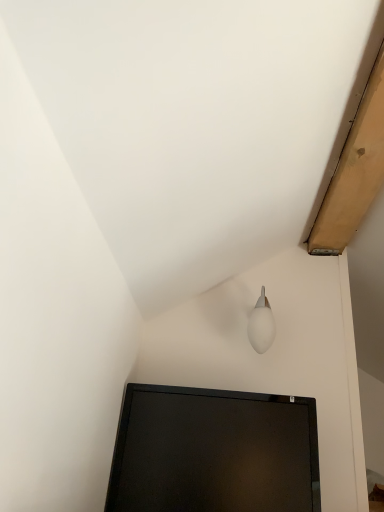
Describe the element at coordinates (214, 452) in the screenshot. The width and height of the screenshot is (384, 512). I see `black glossy monitor at lower center` at that location.

You are a GUI agent. You are given a task and a screenshot of the screen. Output one action in this format:
    pyautogui.click(x=<x>, y=<y>)
    Task: Click on the black glossy monitor at lower center
    This screenshot has height=512, width=384.
    Given the screenshot: What is the action you would take?
    pyautogui.click(x=214, y=452)

What do you see at coordinates (261, 325) in the screenshot? I see `white frosted glass lamp at upper right` at bounding box center [261, 325].

Identify the location of white frosted glass lamp at upper right. (261, 325).

What is the approximate width of white frosted glass lamp at upper right?

white frosted glass lamp at upper right is 19.80 centimeters wide.

The width and height of the screenshot is (384, 512). What are the coordinates of `black glossy monitor at lower center` in the screenshot? It's located at (214, 452).

Between white frosted glass lamp at upper right and black glossy monitor at lower center, which one appears on the left side from the viewer's perspective?

black glossy monitor at lower center is more to the left.

Between white frosted glass lamp at upper right and black glossy monitor at lower center, which one is positioned behind?

white frosted glass lamp at upper right.

Is point (265, 340) less distant than point (171, 421)?

No, it is not.

From the image's perspective, does white frosted glass lamp at upper right appear lower than black glossy monitor at lower center?

Actually, white frosted glass lamp at upper right appears above black glossy monitor at lower center in the image.

From a real-world perspective, is white frosted glass lamp at upper right on top of black glossy monitor at lower center?

Correct, in the physical world, white frosted glass lamp at upper right is higher than black glossy monitor at lower center.

Does white frosted glass lamp at upper right have a greater width compared to black glossy monitor at lower center?

No, white frosted glass lamp at upper right is not wider than black glossy monitor at lower center.

Can you confirm if white frosted glass lamp at upper right is shorter than black glossy monitor at lower center?

Yes.

Between white frosted glass lamp at upper right and black glossy monitor at lower center, which one has larger size?

Bigger between the two is black glossy monitor at lower center.

Do you think white frosted glass lamp at upper right is within black glossy monitor at lower center, or outside of it?

white frosted glass lamp at upper right is not inside black glossy monitor at lower center, it's outside.

Does white frosted glass lamp at upper right touch black glossy monitor at lower center?

white frosted glass lamp at upper right and black glossy monitor at lower center are not in contact.

Is white frosted glass lamp at upper right oriented towards black glossy monitor at lower center?

No, white frosted glass lamp at upper right is not aimed at black glossy monitor at lower center.

Where is `lamp located above the black glossy monitor at lower center (from a real-world perspective)`? lamp located above the black glossy monitor at lower center (from a real-world perspective) is located at coordinates (261, 325).

Visually, is black glossy monitor at lower center positioned to the left or to the right of white frosted glass lamp at upper right?

black glossy monitor at lower center is positioned on white frosted glass lamp at upper right's left side.

Who is more distant, black glossy monitor at lower center or white frosted glass lamp at upper right?

white frosted glass lamp at upper right.

Is point (257, 472) positioned behind point (272, 331)?

No, (257, 472) is in front of (272, 331).

From the image's perspective, which is below, black glossy monitor at lower center or white frosted glass lamp at upper right?

black glossy monitor at lower center.

From a real-world perspective, which is physically below, black glossy monitor at lower center or white frosted glass lamp at upper right?

black glossy monitor at lower center.

Can you confirm if black glossy monitor at lower center is thinner than white frosted glass lamp at upper right?

Incorrect, the width of black glossy monitor at lower center is not less than that of white frosted glass lamp at upper right.

Can you confirm if black glossy monitor at lower center is taller than white frosted glass lamp at upper right?

Yes, black glossy monitor at lower center is taller than white frosted glass lamp at upper right.

Can you confirm if black glossy monitor at lower center is smaller than white frosted glass lamp at upper right?

No.

Is black glossy monitor at lower center inside the boundaries of white frosted glass lamp at upper right, or outside?

The correct answer is: outside.

Is black glossy monitor at lower center in contact with white frosted glass lamp at upper right?

black glossy monitor at lower center and white frosted glass lamp at upper right are clearly separated.

Could you tell me if black glossy monitor at lower center is turned towards white frosted glass lamp at upper right?

No, black glossy monitor at lower center is not oriented towards white frosted glass lamp at upper right.

What's the angular difference between black glossy monitor at lower center and white frosted glass lamp at upper right's facing directions?

91 degrees.

Locate an element on the screen. This screenshot has height=512, width=384. computer monitor located below the white frosted glass lamp at upper right (from the image's perspective) is located at coordinates (214, 452).

Image resolution: width=384 pixels, height=512 pixels. Identify the location of computer monitor that appears below the white frosted glass lamp at upper right (from the image's perspective). click(x=214, y=452).

The width and height of the screenshot is (384, 512). What are the coordinates of `computer monitor in front of the white frosted glass lamp at upper right` in the screenshot? It's located at (x=214, y=452).